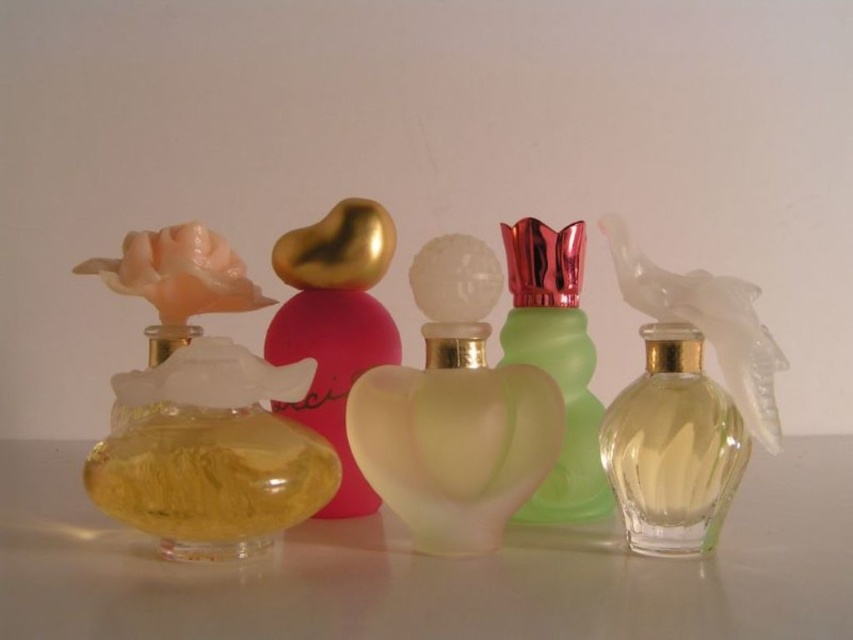
Does satin white heart-shaped perfume at center have a greater height compared to clear glass perfume at center right?

Incorrect, satin white heart-shaped perfume at center's height is not larger of clear glass perfume at center right's.

The width and height of the screenshot is (853, 640). What do you see at coordinates (454, 412) in the screenshot?
I see `satin white heart-shaped perfume at center` at bounding box center [454, 412].

Describe the element at coordinates (454, 412) in the screenshot. I see `satin white heart-shaped perfume at center` at that location.

Where is `satin white heart-shaped perfume at center`? satin white heart-shaped perfume at center is located at coordinates (454, 412).

Does satin white heart-shaped perfume at center have a greater height compared to green frosted glass perfume at center?

Incorrect, satin white heart-shaped perfume at center's height is not larger of green frosted glass perfume at center's.

Which of these two, satin white heart-shaped perfume at center or green frosted glass perfume at center, stands taller?

With more height is green frosted glass perfume at center.

Is point (548, 460) more distant than point (552, 342)?

No.

The image size is (853, 640). Find the location of `satin white heart-shaped perfume at center`. satin white heart-shaped perfume at center is located at coordinates (454, 412).

Who is higher up, satin white heart-shaped perfume at center or gold metallic heart at center?

gold metallic heart at center is higher up.

In the scene shown: Which is more to the right, satin white heart-shaped perfume at center or gold metallic heart at center?

satin white heart-shaped perfume at center is more to the right.

What do you see at coordinates (454, 412) in the screenshot?
I see `satin white heart-shaped perfume at center` at bounding box center [454, 412].

You are a GUI agent. You are given a task and a screenshot of the screen. Output one action in this format:
    pyautogui.click(x=<x>, y=<y>)
    Task: Click on the satin white heart-shaped perfume at center
    The width and height of the screenshot is (853, 640).
    Given the screenshot: What is the action you would take?
    pyautogui.click(x=454, y=412)